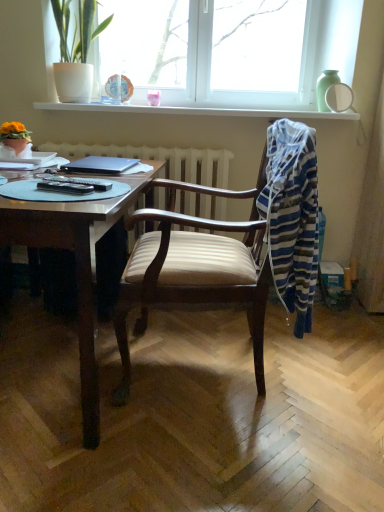
Question: Considering the relative positions of white glossy window sill at upper center and matte orange flower pot at left, which ranks as the 2th houseplant in right-to-left order, in the image provided, is white glossy window sill at upper center to the left of matte orange flower pot at left, which ranks as the 2th houseplant in right-to-left order, from the viewer's perspective?

Choices:
 (A) no
 (B) yes

Answer: (A)

Question: From a real-world perspective, is white glossy window sill at upper center positioned under matte orange flower pot at left, which is the second houseplant from back to front, based on gravity?

Choices:
 (A) yes
 (B) no

Answer: (B)

Question: Is white glossy window sill at upper center turned away from matte orange flower pot at left, positioned as the first houseplant in front-to-back order?

Choices:
 (A) yes
 (B) no

Answer: (B)

Question: Is white glossy window sill at upper center smaller than matte orange flower pot at left, positioned as the first houseplant in front-to-back order?

Choices:
 (A) no
 (B) yes

Answer: (A)

Question: From a real-world perspective, is white glossy window sill at upper center on top of matte orange flower pot at left, which is the second houseplant from back to front?

Choices:
 (A) yes
 (B) no

Answer: (A)

Question: Is white glossy window sill at upper center positioned before matte orange flower pot at left, which is the first houseplant in left-to-right order?

Choices:
 (A) no
 (B) yes

Answer: (A)

Question: Is satin black laptop at center facing away from white matte pot at upper left, the second houseplant in the front-to-back sequence?

Choices:
 (A) no
 (B) yes

Answer: (A)

Question: From a real-world perspective, is satin black laptop at center physically above white matte pot at upper left, marked as the 1th houseplant in a back-to-front arrangement?

Choices:
 (A) yes
 (B) no

Answer: (B)

Question: Is satin black laptop at center surrounding white matte pot at upper left, the 2th houseplant viewed from the left?

Choices:
 (A) no
 (B) yes

Answer: (A)

Question: Is satin black laptop at center closer to the viewer compared to white matte pot at upper left, the second houseplant positioned from the bottom?

Choices:
 (A) no
 (B) yes

Answer: (B)

Question: Is satin black laptop at center far away from white matte pot at upper left, the second houseplant positioned from the bottom?

Choices:
 (A) no
 (B) yes

Answer: (A)

Question: Is satin black laptop at center not inside white matte pot at upper left, the second houseplant positioned from the bottom?

Choices:
 (A) no
 (B) yes

Answer: (B)

Question: Is striped cotton laundry at right surrounded by matte orange flower pot at left, the first houseplant ordered from the bottom?

Choices:
 (A) yes
 (B) no

Answer: (B)